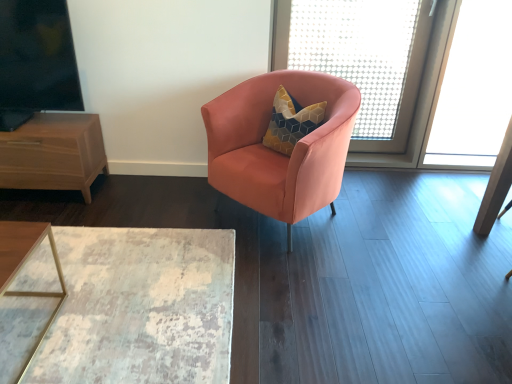
Measure the distance between black glass window screen at upper left, arranged as the 1th window screen when viewed from the front, and camera.

black glass window screen at upper left, arranged as the 1th window screen when viewed from the front, is 7.63 feet away from camera.

Describe the element at coordinates (361, 58) in the screenshot. This screenshot has height=384, width=512. I see `translucent mesh screen at upper right, acting as the 1th window screen starting from the right` at that location.

How much space does translucent mesh screen at upper right, the 2th window screen positioned from the left, occupy horizontally?

It is 5.49 inches.

The image size is (512, 384). I want to click on satin peach armchair at center, so click(276, 152).

The width and height of the screenshot is (512, 384). What are the coordinates of `brown wood nightstand at left` in the screenshot? It's located at (53, 153).

Considering the relative sizes of distressed wood table at lower left and translucent mesh screen at upper right, which is counted as the 2th window screen, starting from the front, in the image provided, is distressed wood table at lower left thinner than translucent mesh screen at upper right, which is counted as the 2th window screen, starting from the front,?

In fact, distressed wood table at lower left might be wider than translucent mesh screen at upper right, which is counted as the 2th window screen, starting from the front.

Relative to translucent mesh screen at upper right, which is counted as the 2th window screen, starting from the front, is distressed wood table at lower left in front or behind?

distressed wood table at lower left is in front of translucent mesh screen at upper right, which is counted as the 2th window screen, starting from the front.

Which is more to the right, distressed wood table at lower left or translucent mesh screen at upper right, acting as the 1th window screen starting from the right?

translucent mesh screen at upper right, acting as the 1th window screen starting from the right, is more to the right.

Is distressed wood table at lower left oriented away from satin peach armchair at center?

No, distressed wood table at lower left is not facing the opposite direction of satin peach armchair at center.

From a real-world perspective, is distressed wood table at lower left physically below satin peach armchair at center?

Yes.

Can you confirm if distressed wood table at lower left is positioned to the right of satin peach armchair at center?

In fact, distressed wood table at lower left is to the left of satin peach armchair at center.

Is distressed wood table at lower left located outside satin peach armchair at center?

Absolutely, distressed wood table at lower left is external to satin peach armchair at center.

Could you tell me if black glass window screen at upper left, acting as the 1th window screen starting from the left, is turned towards brown wood nightstand at left?

No, black glass window screen at upper left, acting as the 1th window screen starting from the left, is not turned towards brown wood nightstand at left.

Which object is closer to the camera, black glass window screen at upper left, which is the second window screen from right to left, or brown wood nightstand at left?

black glass window screen at upper left, which is the second window screen from right to left.

From the image's perspective, relative to brown wood nightstand at left, is black glass window screen at upper left, the second window screen from the back, above or below?

Clearly, from the image's perspective, black glass window screen at upper left, the second window screen from the back, is above brown wood nightstand at left.

The image size is (512, 384). What are the coordinates of `nightstand below the black glass window screen at upper left, which is the second window screen from right to left (from a real-world perspective)` in the screenshot? It's located at (53, 153).

Is distressed wood table at lower left inside the boundaries of black glass window screen at upper left, the second window screen from the back, or outside?

distressed wood table at lower left cannot be found inside black glass window screen at upper left, the second window screen from the back.

From a real-world perspective, who is located lower, distressed wood table at lower left or black glass window screen at upper left, acting as the 1th window screen starting from the left?

From a 3D spatial view, distressed wood table at lower left is below.

Locate an element on the screen. Image resolution: width=512 pixels, height=384 pixels. the 1st window screen behind when counting from the distressed wood table at lower left is located at coordinates (37, 56).

Based on the photo, from the image's perspective, which is below, distressed wood table at lower left or black glass window screen at upper left, acting as the 1th window screen starting from the left?

distressed wood table at lower left is shown below in the image.

Is satin peach armchair at center with brown wood nightstand at left?

They are not placed beside each other.

Considering their positions, is satin peach armchair at center located in front of or behind brown wood nightstand at left?

satin peach armchair at center is in front of brown wood nightstand at left.

Where is `nightstand on the left of satin peach armchair at center`? The height and width of the screenshot is (384, 512). nightstand on the left of satin peach armchair at center is located at coordinates (53, 153).

Is satin peach armchair at center facing away from brown wood nightstand at left?

No, satin peach armchair at center's orientation is not away from brown wood nightstand at left.

Can you confirm if translucent mesh screen at upper right, the 2th window screen positioned from the left, is taller than distressed wood table at lower left?

Correct, translucent mesh screen at upper right, the 2th window screen positioned from the left, is much taller as distressed wood table at lower left.

From a real-world perspective, is translucent mesh screen at upper right, which is counted as the 2th window screen, starting from the front, physically below distressed wood table at lower left?

Actually, translucent mesh screen at upper right, which is counted as the 2th window screen, starting from the front, is physically above distressed wood table at lower left in the real world.

Does point (394, 108) come in front of point (216, 362)?

No, (394, 108) is behind (216, 362).

Are translucent mesh screen at upper right, the 2th window screen positioned from the left, and distressed wood table at lower left located far from each other?

Absolutely, translucent mesh screen at upper right, the 2th window screen positioned from the left, is distant from distressed wood table at lower left.

Consider the image. Who is more distant, brown wood nightstand at left or distressed wood table at lower left?

brown wood nightstand at left is behind.

From the picture: How different are the orientations of brown wood nightstand at left and distressed wood table at lower left in degrees?

The angle between the facing direction of brown wood nightstand at left and the facing direction of distressed wood table at lower left is 90.1 degrees.

At what (x,y) coordinates should I click in order to perform the action: click on table in front of the brown wood nightstand at left. Please return your answer as a coordinate pair (x, y). The image size is (512, 384). Looking at the image, I should click on (140, 307).

You are a GUI agent. You are given a task and a screenshot of the screen. Output one action in this format:
    pyautogui.click(x=<x>, y=<y>)
    Task: Click on the table located below the translucent mesh screen at upper right, which is counted as the 2th window screen, starting from the front (from the image's perspective)
    
    Given the screenshot: What is the action you would take?
    pyautogui.click(x=140, y=307)

Where is `chair that appears behind the distressed wood table at lower left`? chair that appears behind the distressed wood table at lower left is located at coordinates (276, 152).

Based on their spatial positions, is satin peach armchair at center or distressed wood table at lower left further from brown wood nightstand at left?

Based on the image, satin peach armchair at center appears to be further to brown wood nightstand at left.

From the picture: From the image, which object appears to be nearer to satin peach armchair at center, distressed wood table at lower left or translucent mesh screen at upper right, acting as the 1th window screen starting from the right?

The object closer to satin peach armchair at center is distressed wood table at lower left.

Looking at the image, which one is located further to brown wood nightstand at left, translucent mesh screen at upper right, which is counted as the 2th window screen, starting from the front, or distressed wood table at lower left?

Based on the image, translucent mesh screen at upper right, which is counted as the 2th window screen, starting from the front, appears to be further to brown wood nightstand at left.

Looking at the image, which one is located further to distressed wood table at lower left, satin peach armchair at center or translucent mesh screen at upper right, which is counted as the 2th window screen, starting from the front?

translucent mesh screen at upper right, which is counted as the 2th window screen, starting from the front.

Estimate the real-world distances between objects in this image. Which object is further from distressed wood table at lower left, satin peach armchair at center or brown wood nightstand at left?

Among the two, brown wood nightstand at left is located further to distressed wood table at lower left.

When comparing their distances from translucent mesh screen at upper right, the 2th window screen positioned from the left, does brown wood nightstand at left or black glass window screen at upper left, acting as the 1th window screen starting from the left, seem closer?

Among the two, black glass window screen at upper left, acting as the 1th window screen starting from the left, is located nearer to translucent mesh screen at upper right, the 2th window screen positioned from the left.

Which object lies further to the anchor point translucent mesh screen at upper right, which is counted as the 2th window screen, starting from the front, satin peach armchair at center or brown wood nightstand at left?

The object further to translucent mesh screen at upper right, which is counted as the 2th window screen, starting from the front, is brown wood nightstand at left.

Which object lies further to the anchor point satin peach armchair at center, black glass window screen at upper left, the second window screen from the back, or brown wood nightstand at left?

The object further to satin peach armchair at center is black glass window screen at upper left, the second window screen from the back.

Locate an element on the screen. window screen between brown wood nightstand at left and satin peach armchair at center is located at coordinates (37, 56).

Where is `table located between brown wood nightstand at left and translucent mesh screen at upper right, the 2th window screen positioned from the left, in the left-right direction`? The width and height of the screenshot is (512, 384). table located between brown wood nightstand at left and translucent mesh screen at upper right, the 2th window screen positioned from the left, in the left-right direction is located at coordinates (140, 307).

I want to click on nightstand between black glass window screen at upper left, which is the second window screen from right to left, and distressed wood table at lower left from top to bottom, so point(53,153).

The width and height of the screenshot is (512, 384). I want to click on table located between brown wood nightstand at left and satin peach armchair at center in the left-right direction, so click(x=140, y=307).